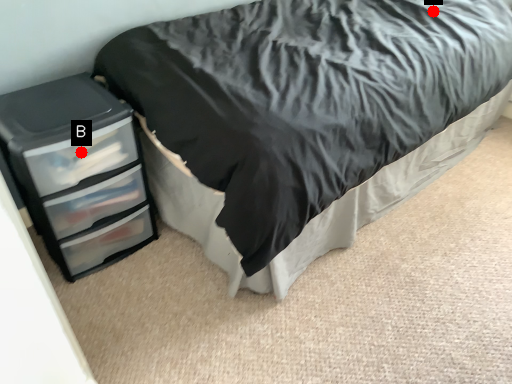
Question: Two points are circled on the image, labeled by A and B beside each circle. Which point is closer to the camera?

Choices:
 (A) A is closer
 (B) B is closer

Answer: (B)